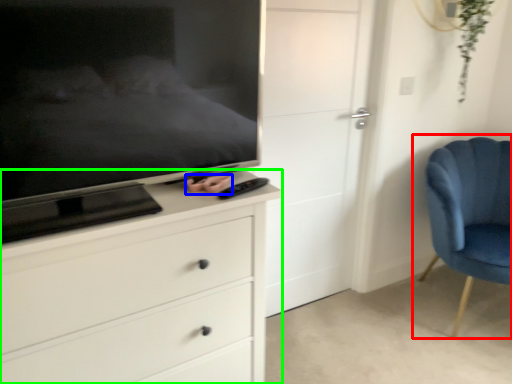
Question: Considering the real-world distances, which object is farthest from chair (highlighted by a red box)? hand (highlighted by a blue box) or chest of drawers (highlighted by a green box)?

Choices:
 (A) hand
 (B) chest of drawers

Answer: (A)